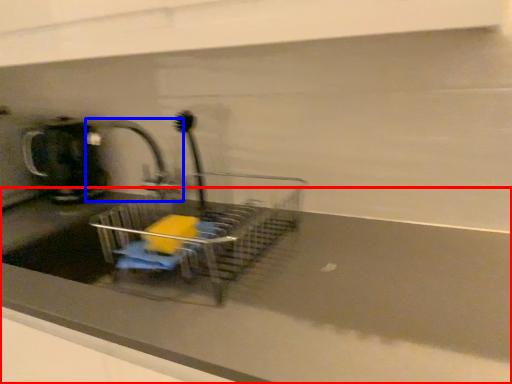
Question: Which object is closer to the camera taking this photo, counter top (highlighted by a red box) or tap (highlighted by a blue box)?

Choices:
 (A) counter top
 (B) tap

Answer: (A)